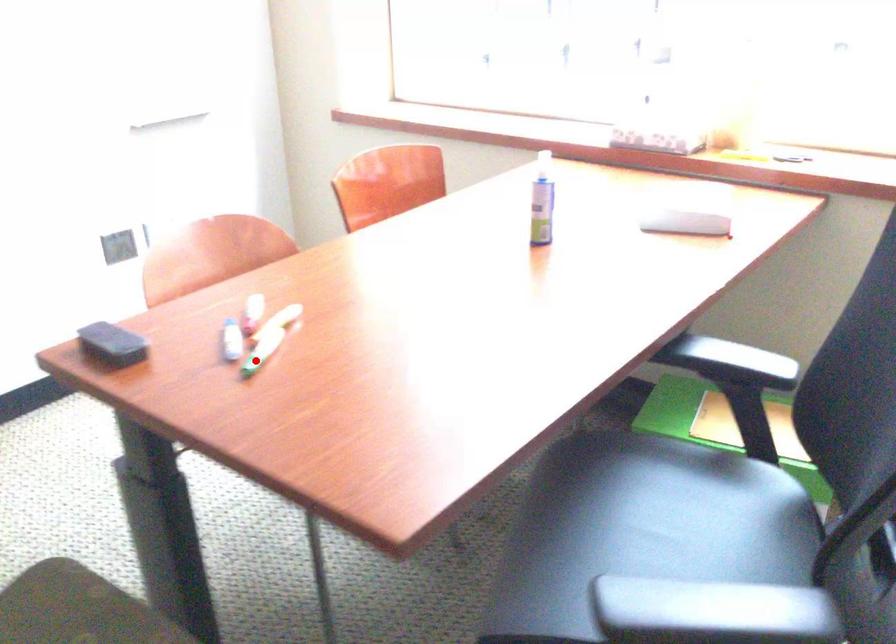
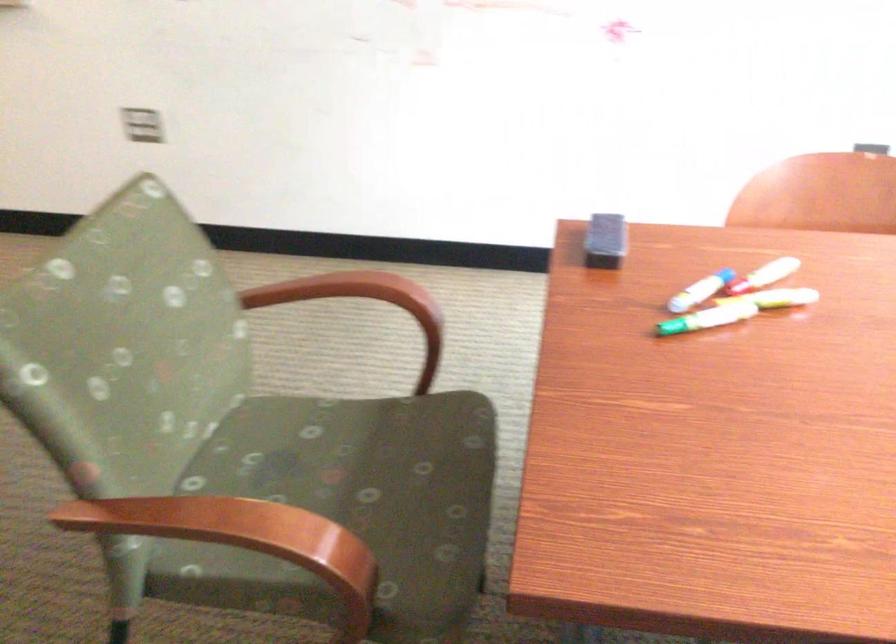
Question: I am providing you with two images of the same scene from different viewpoints. Given a red point in image1, look at the same physical point in image2. Is it:

Choices:
 (A) Closer to the viewpoint
 (B) Farther from the viewpoint

Answer: (A)